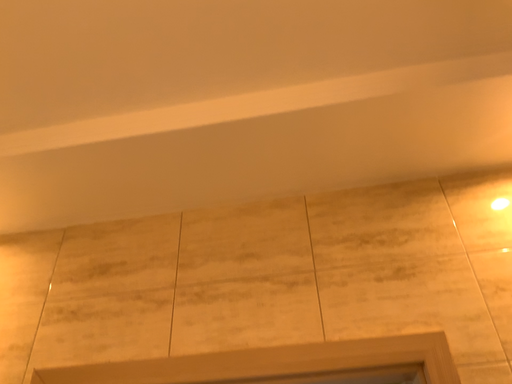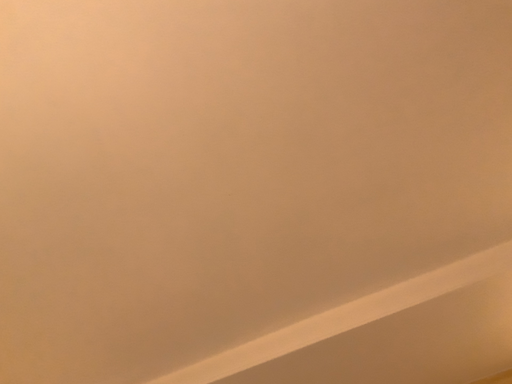
Question: How did the camera likely rotate when shooting the video?

Choices:
 (A) rotated right
 (B) rotated left

Answer: (B)